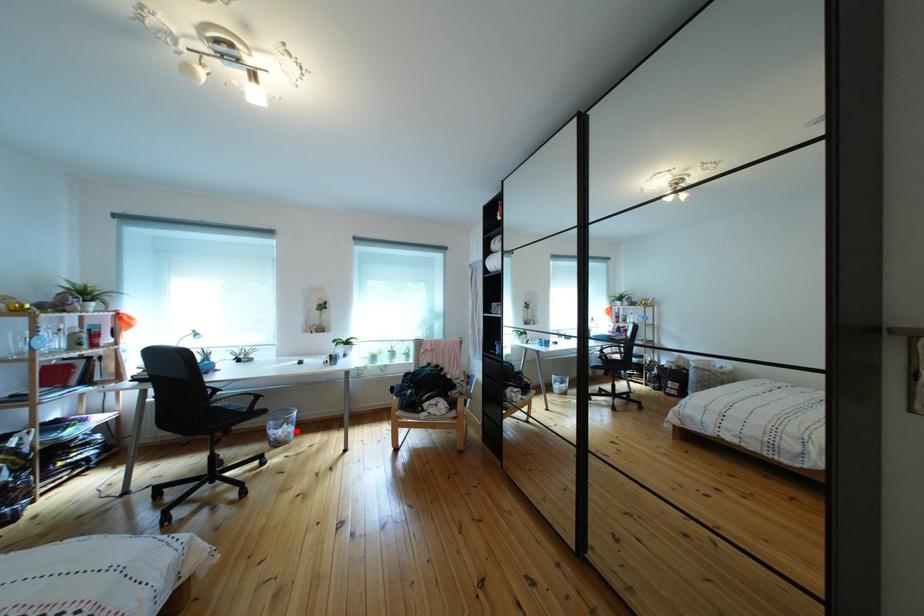
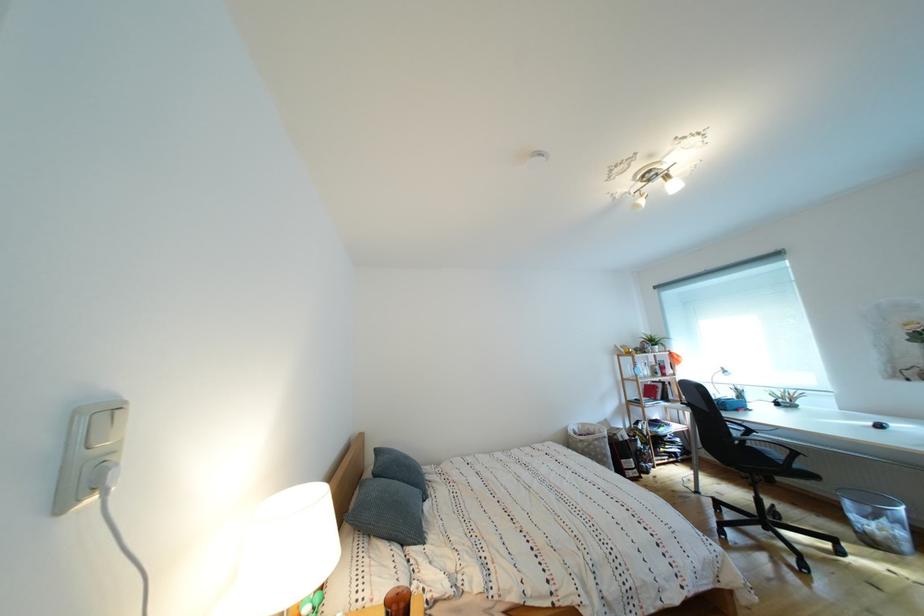
Question: I am providing you with two images of the same scene from different viewpoints. Given a red point in image1, look at the same physical point in image2. Is it:

Choices:
 (A) Closer to the viewpoint
 (B) Farther from the viewpoint

Answer: (A)